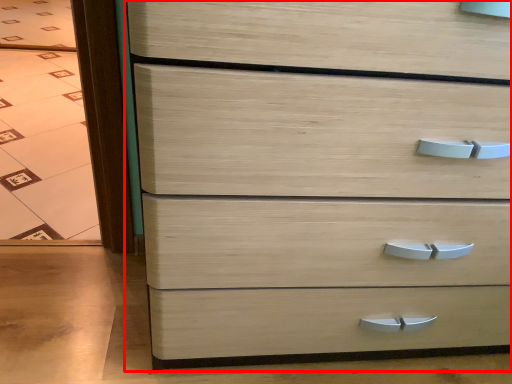
Question: From the image, what is the correct spatial relationship of chest of drawers (annotated by the red box) in relation to glass door?

Choices:
 (A) left
 (B) right

Answer: (B)